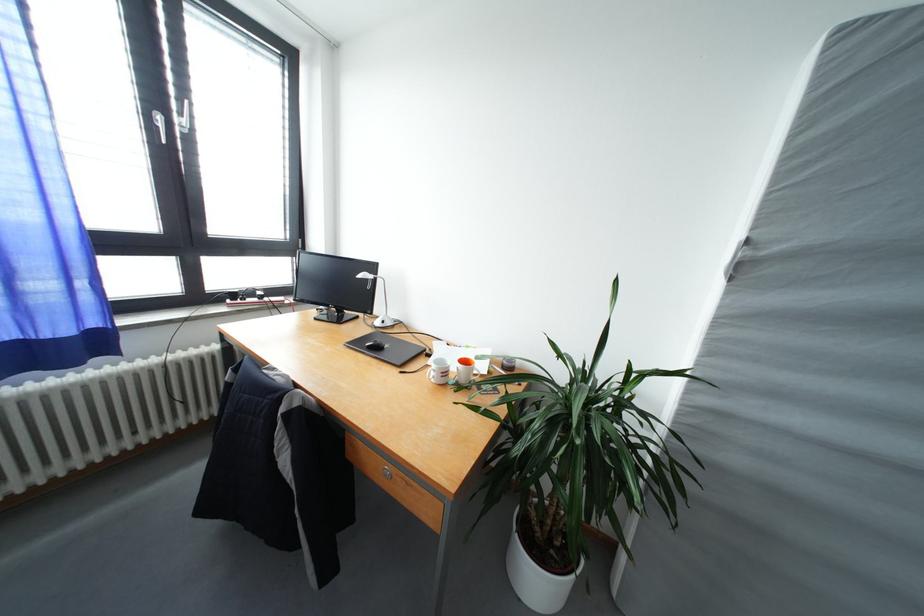
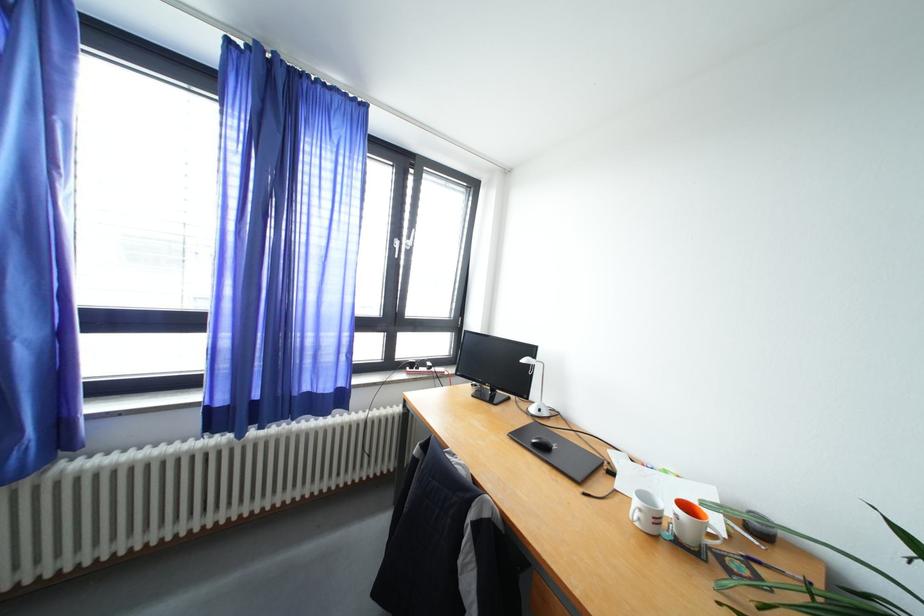
Where in the second image is the point corresponding to point 469,386 from the first image?

(695, 546)